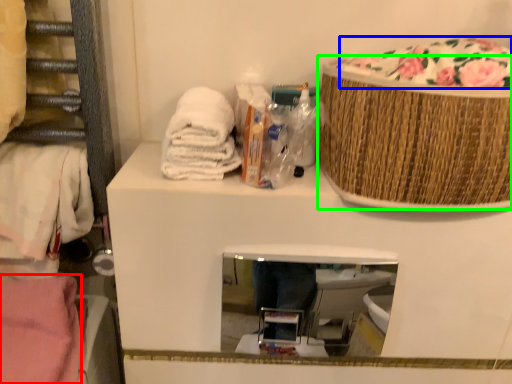
Question: Estimate the real-world distances between objects in this image. Which object is farther from material (highlighted by a red box), food (highlighted by a blue box) or basket (highlighted by a green box)?

Choices:
 (A) food
 (B) basket

Answer: (A)